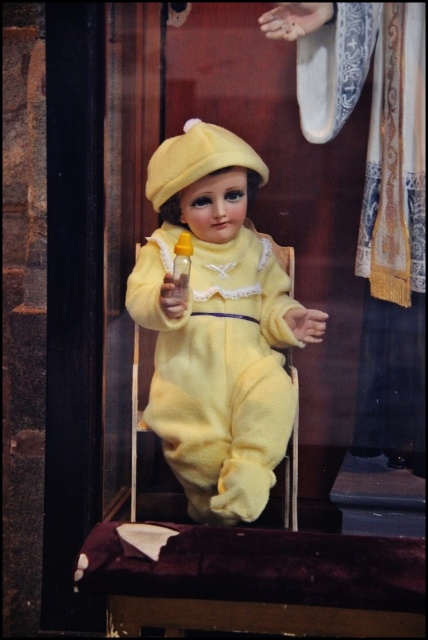
Question: Which point is closer to the camera taking this photo?

Choices:
 (A) (210, 515)
 (B) (181, 284)

Answer: (B)

Question: Which object is farther from the camera taking this photo?

Choices:
 (A) translucent yellow bottle at center
 (B) yellow plush doll at center

Answer: (A)

Question: Can you confirm if yellow plush doll at center is bigger than translucent yellow bottle at center?

Choices:
 (A) yes
 (B) no

Answer: (A)

Question: Where is yellow plush doll at center located in relation to translucent yellow bottle at center in the image?

Choices:
 (A) right
 (B) left

Answer: (A)

Question: Considering the relative positions of yellow plush doll at center and translucent yellow bottle at center in the image provided, where is yellow plush doll at center located with respect to translucent yellow bottle at center?

Choices:
 (A) right
 (B) left

Answer: (A)